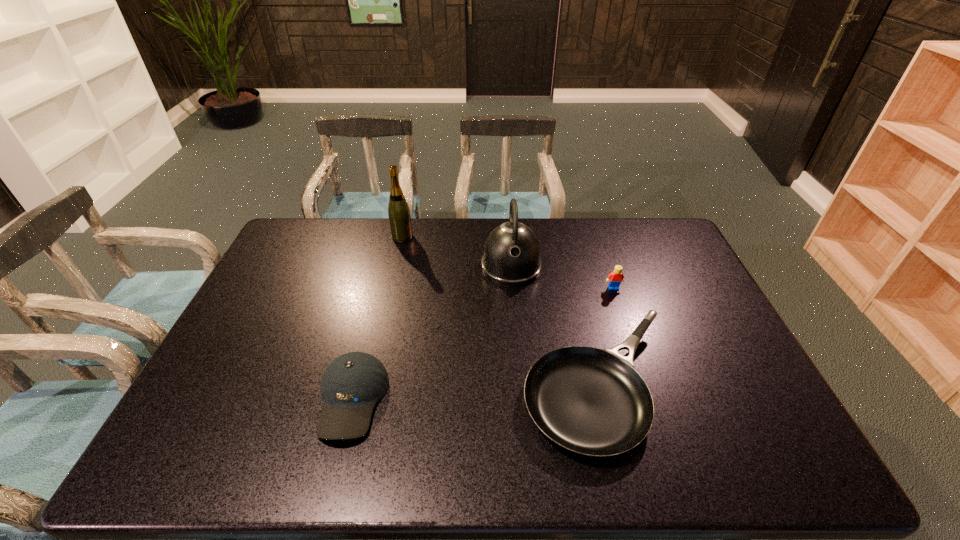
Where is `empty space between the shortest object and the wine bottle`? The image size is (960, 540). empty space between the shortest object and the wine bottle is located at coordinates (500, 312).

Locate an element on the screen. vacant space that's between the baseball cap and the pan is located at coordinates (475, 393).

This screenshot has height=540, width=960. Identify the location of vacant point located between the baseball cap and the Lego. (483, 343).

This screenshot has width=960, height=540. What are the coordinates of `empty space between the baseball cap and the farthest object` in the screenshot? It's located at (377, 318).

This screenshot has height=540, width=960. Identify the location of free space between the kettle and the shortest object. (555, 326).

Locate an element on the screen. free spot between the baseball cap and the Lego is located at coordinates click(483, 343).

At what (x,y) coordinates should I click in order to perform the action: click on blank region between the baseball cap and the shortest object. Please return your answer as a coordinate pair (x, y). Looking at the image, I should click on (475, 393).

This screenshot has height=540, width=960. I want to click on free space between the baseball cap and the Lego, so click(x=483, y=343).

You are a GUI agent. You are given a task and a screenshot of the screen. Output one action in this format:
    pyautogui.click(x=<x>, y=<y>)
    Task: Click on the vacant area that lies between the baseball cap and the farthest object
    
    Given the screenshot: What is the action you would take?
    pyautogui.click(x=377, y=318)

Where is `object that is the second closest to the kettle`? object that is the second closest to the kettle is located at coordinates (615, 278).